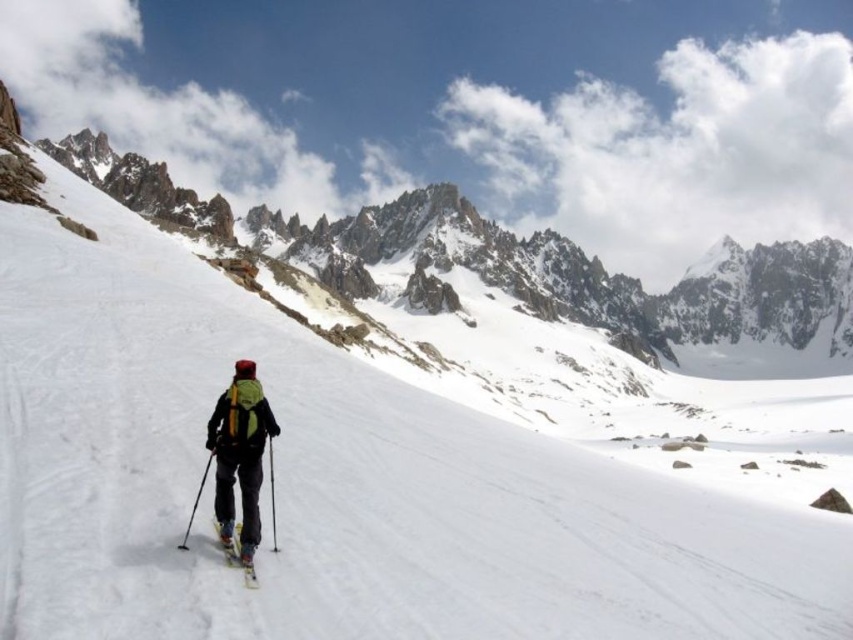
Question: Is black plastic ski pole at center positioned before black plastic ski pole at lower left?

Choices:
 (A) no
 (B) yes

Answer: (A)

Question: Which point appears farthest from the camera in this image?

Choices:
 (A) (271, 536)
 (B) (241, 451)
 (C) (196, 502)

Answer: (B)

Question: Which object appears closest to the camera in this image?

Choices:
 (A) black plastic ski pole at lower left
 (B) matte green backpack at center
 (C) black plastic ski pole at center
 (D) yellow matte ski at lower center

Answer: (D)

Question: Which of these objects is positioned closest to the black plastic ski pole at center?

Choices:
 (A) matte green backpack at center
 (B) black plastic ski pole at lower left

Answer: (A)

Question: Is matte green backpack at center below yellow matte ski at lower center?

Choices:
 (A) no
 (B) yes

Answer: (A)

Question: Can you confirm if yellow matte ski at lower center is bigger than black plastic ski pole at lower left?

Choices:
 (A) yes
 (B) no

Answer: (B)